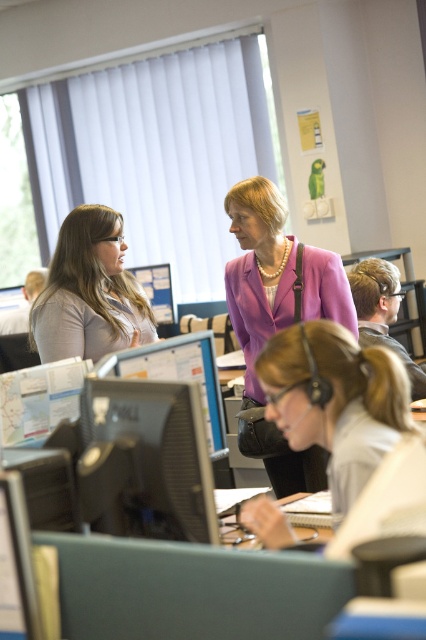
Question: Can you confirm if purple matte blazer at center is positioned below matte black monitor at center?

Choices:
 (A) yes
 (B) no

Answer: (B)

Question: Which point appears farthest from the camera in this image?

Choices:
 (A) click(363, 483)
 (B) click(144, 419)
 (C) click(215, 372)
 (D) click(60, 289)

Answer: (D)

Question: Can you confirm if light brown hair at center is thinner than black glossy monitor at center?

Choices:
 (A) yes
 (B) no

Answer: (B)

Question: Does black glossy monitor at center have a greater width compared to matte gray shirt at left?

Choices:
 (A) yes
 (B) no

Answer: (B)

Question: Estimate the real-world distances between objects in this image. Which object is farther from the matte gray shirt at left?

Choices:
 (A) light brown hair at center
 (B) purple matte blazer at center
 (C) matte black monitor at center

Answer: (A)

Question: Which of the following is the farthest from the observer?

Choices:
 (A) (250, 225)
 (B) (144, 349)
 (C) (115, 262)

Answer: (C)